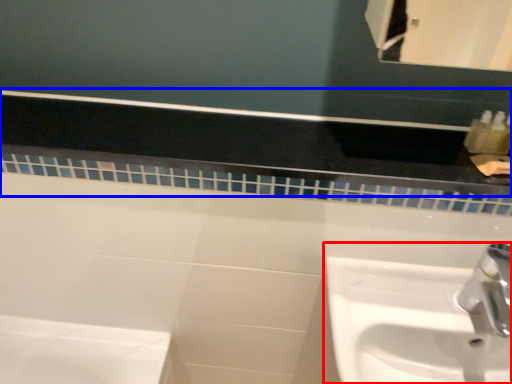
Question: Among these objects, which one is farthest to the camera, sink (highlighted by a red box) or balustrade (highlighted by a blue box)?

Choices:
 (A) sink
 (B) balustrade

Answer: (B)